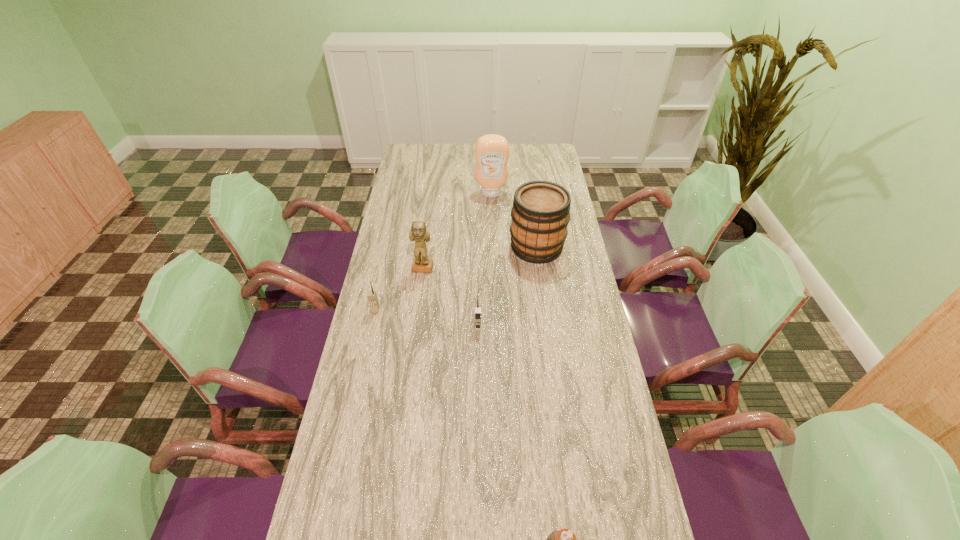
Identify the location of vacant space located on the front of the left cellular telephone, where the keypad is located. Image resolution: width=960 pixels, height=540 pixels. (357, 395).

Where is `vacant region located 0.120m on the front-facing side of the right cellular telephone`? This screenshot has width=960, height=540. vacant region located 0.120m on the front-facing side of the right cellular telephone is located at coordinates point(478,360).

Where is `figurine located in the left edge section of the desktop`? figurine located in the left edge section of the desktop is located at coordinates pyautogui.click(x=419, y=233).

The image size is (960, 540). In order to click on cellular telephone located at the left edge in this screenshot , I will do `click(371, 295)`.

You are a GUI agent. You are given a task and a screenshot of the screen. Output one action in this format:
    pyautogui.click(x=<x>, y=<y>)
    Task: Click on the object that is at the right edge
    The height and width of the screenshot is (540, 960).
    Given the screenshot: What is the action you would take?
    pyautogui.click(x=540, y=214)

Image resolution: width=960 pixels, height=540 pixels. In the image, there is a desktop. Find the location of `vacant space at the far edge`. vacant space at the far edge is located at coordinates (517, 159).

Where is `vacant space at the left edge of the desktop`? vacant space at the left edge of the desktop is located at coordinates (425, 220).

This screenshot has width=960, height=540. What are the coordinates of `vacant area at the right edge` in the screenshot? It's located at (577, 288).

You are a GUI agent. You are given a task and a screenshot of the screen. Output one action in this format:
    pyautogui.click(x=<x>, y=<y>)
    Task: Click on the free space at the far right corner of the desktop
    
    Given the screenshot: What is the action you would take?
    pyautogui.click(x=547, y=165)

Where is `empty space between the farthest object and the nearer cellular telephone`? The width and height of the screenshot is (960, 540). empty space between the farthest object and the nearer cellular telephone is located at coordinates (485, 260).